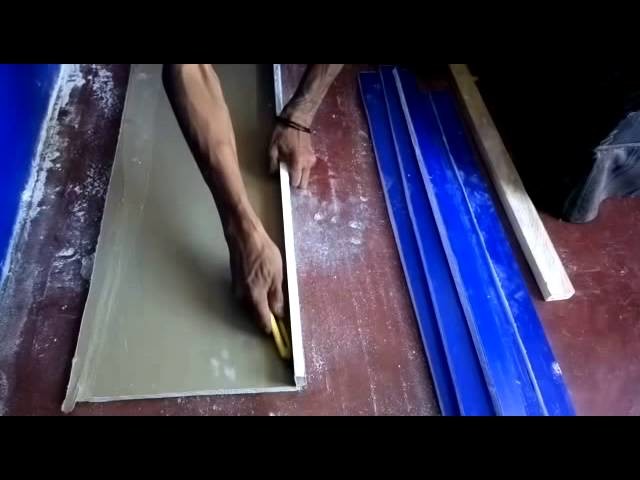
Locate an element on the screen. work area is located at coordinates coord(161,299).